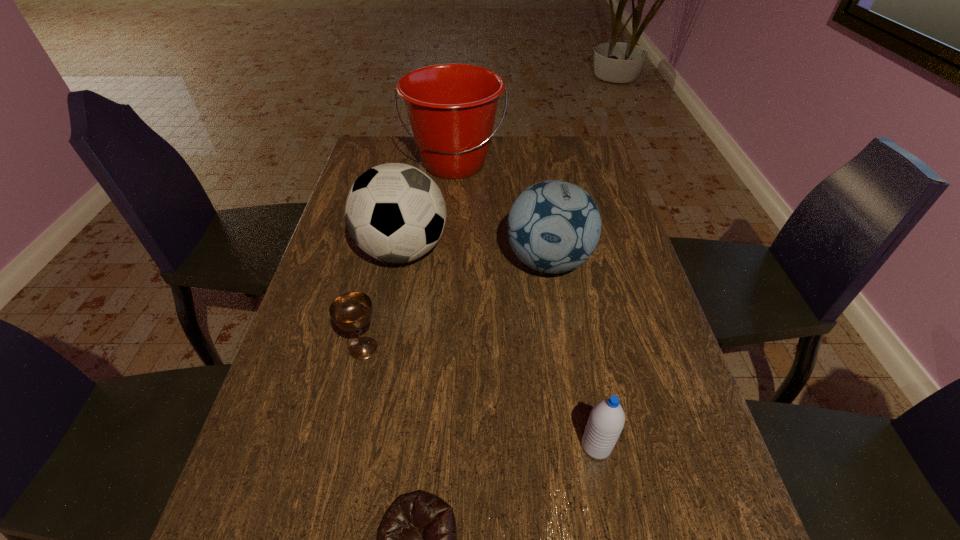
Where is `free spot that satisfies the following two spatial constraints: 1. on the back side of the second nearest object; 2. on the main logo of the left soccer ball`? This screenshot has width=960, height=540. free spot that satisfies the following two spatial constraints: 1. on the back side of the second nearest object; 2. on the main logo of the left soccer ball is located at coordinates (560, 251).

At what (x,y) coordinates should I click in order to perform the action: click on vacant space that satisfies the following two spatial constraints: 1. on the main logo of the fifth farthest object; 2. on the right side of the left soccer ball. Please return your answer as a coordinate pair (x, y). This screenshot has width=960, height=540. Looking at the image, I should click on (366, 446).